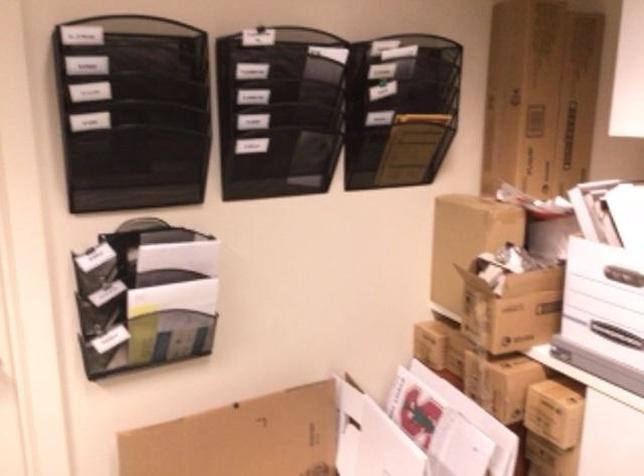
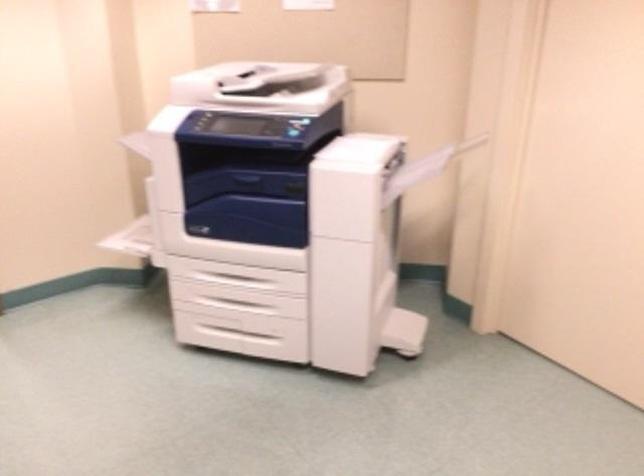
Based on the continuous images, in which direction is the camera rotating?

The camera's rotation is toward left-down.